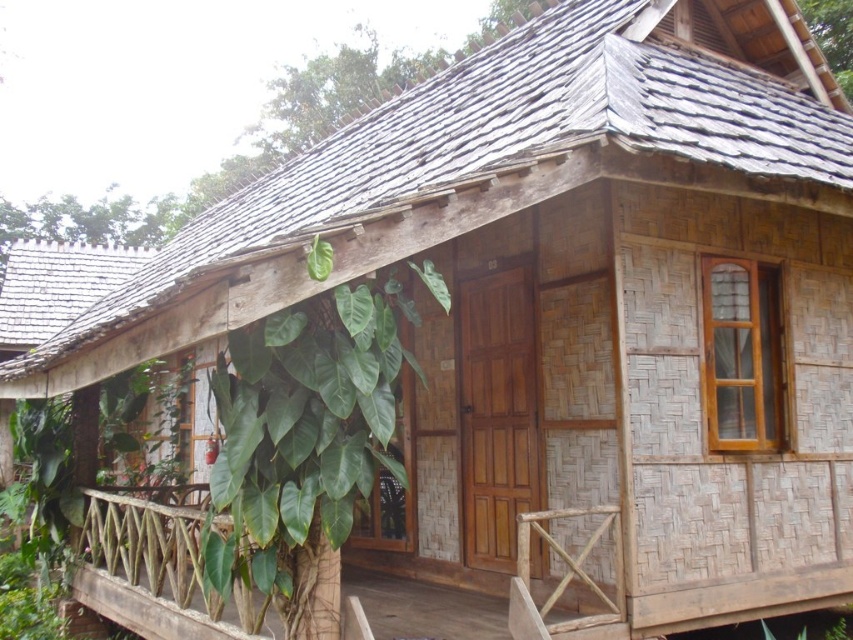
You are standing in front of the wooden structure and want to place a new decorative item. The current green glossy leafy plant at center is at point (302, 435). Where would you place the new item to avoid blocking the view of the plant?

Place the new item away from point (302, 435) to avoid blocking the view of the green glossy leafy plant at center.